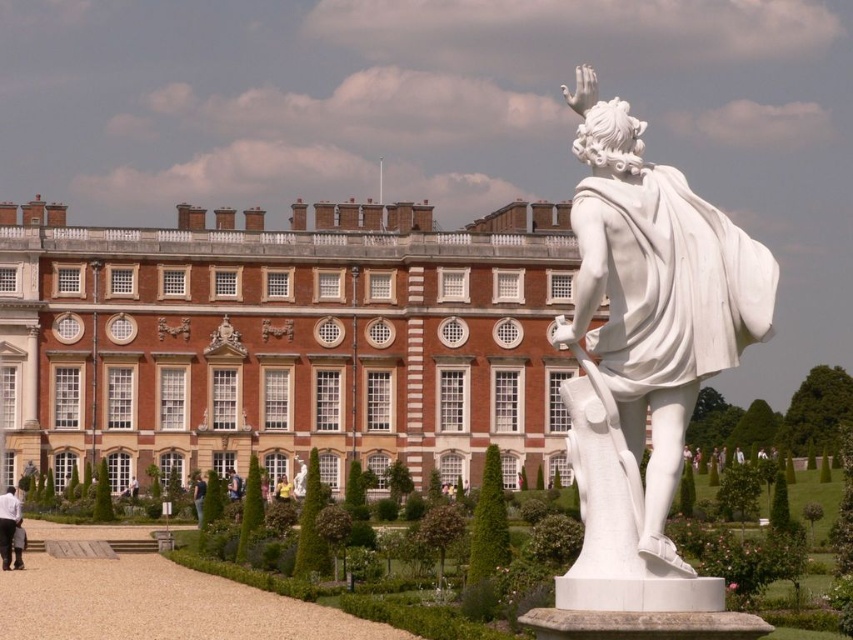
Does blue denim jeans at center have a greater width compared to yellow fabric dress at center?

Indeed, blue denim jeans at center has a greater width compared to yellow fabric dress at center.

Consider the image. Can you confirm if blue denim jeans at center is taller than yellow fabric dress at center?

Yes.

Who is more distant from viewer, (231, 470) or (283, 476)?

Point (283, 476)

Find the location of a particular element. The image size is (853, 640). blue denim jeans at center is located at coordinates (234, 484).

Is green leafy hedge at center thinner than blue denim jeans at lower center?

Result: No.

Does green leafy hedge at center lie behind blue denim jeans at lower center?

That is False.

Which is behind, point (486, 563) or point (202, 486)?

The point (202, 486) is more distant.

Find the location of a particular element. green leafy hedge at center is located at coordinates (488, 522).

Between green hedge at center and blue denim jeans at center, which one is positioned higher?

blue denim jeans at center is above.

Does green hedge at center have a lesser height compared to blue denim jeans at center?

No, green hedge at center is not shorter than blue denim jeans at center.

This screenshot has width=853, height=640. In order to click on green hedge at center in this screenshot , I will do `click(149, 598)`.

You are a GUI agent. You are given a task and a screenshot of the screen. Output one action in this format:
    pyautogui.click(x=<x>, y=<y>)
    Task: Click on the green hedge at center
    Image resolution: width=853 pixels, height=640 pixels.
    Given the screenshot: What is the action you would take?
    pyautogui.click(x=149, y=598)